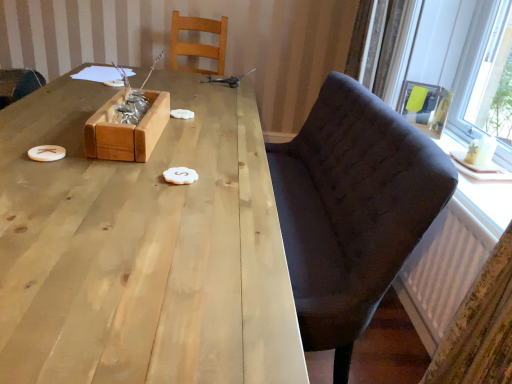
You are a GUI agent. You are given a task and a screenshot of the screen. Output one action in this format:
    pyautogui.click(x=<x>, y=<y>)
    Task: Click on the vacant area located to the right-hand side of wooden box at center
    Image resolution: width=512 pixels, height=384 pixels.
    Given the screenshot: What is the action you would take?
    pyautogui.click(x=208, y=148)